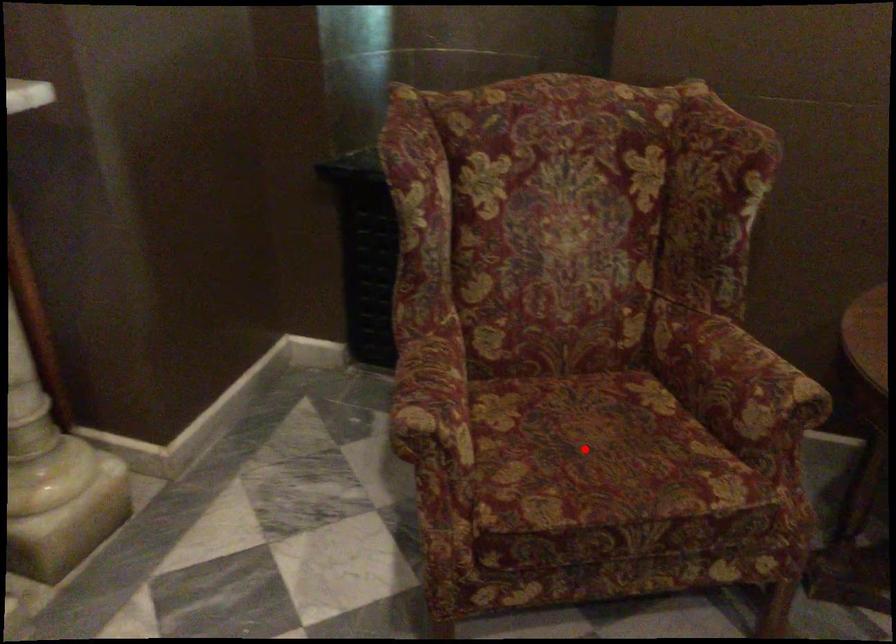
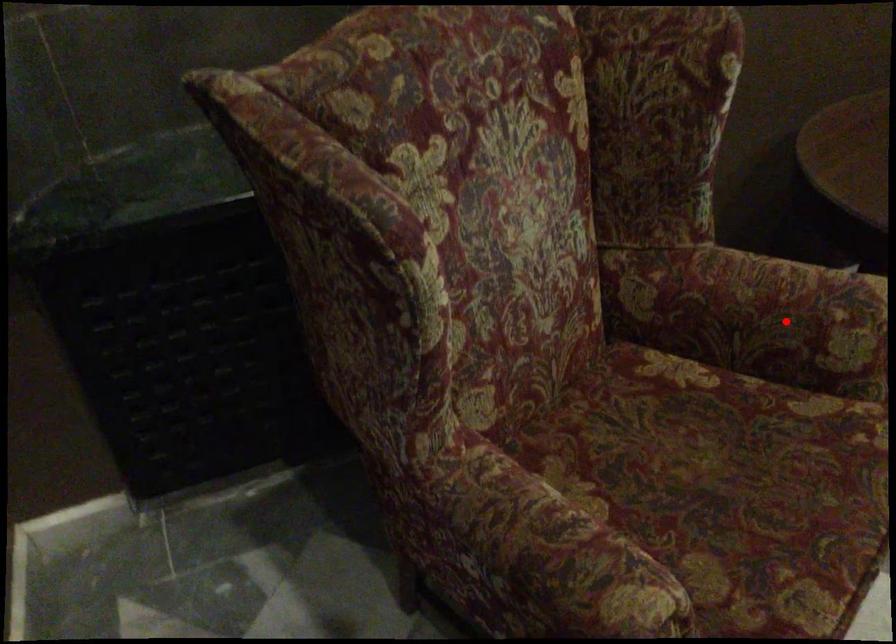
I am providing you with two images of the same scene from different viewpoints. A red point is marked on the first image and another point is marked on the second image. Is the red point in image1 aligned with the point shown in image2?

No